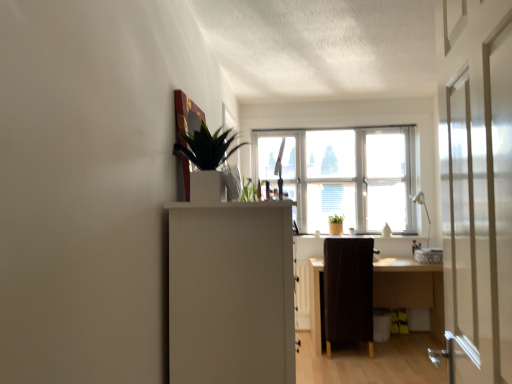
Question: From the image's perspective, is white glossy screen door at right above transparent glass window at center?

Choices:
 (A) yes
 (B) no

Answer: (B)

Question: Is white glossy screen door at right closer to camera compared to transparent glass window at center?

Choices:
 (A) yes
 (B) no

Answer: (A)

Question: Is white glossy screen door at right wider than transparent glass window at center?

Choices:
 (A) yes
 (B) no

Answer: (A)

Question: Is white glossy screen door at right completely or partially outside of transparent glass window at center?

Choices:
 (A) yes
 (B) no

Answer: (A)

Question: Are white glossy screen door at right and transparent glass window at center far apart?

Choices:
 (A) no
 (B) yes

Answer: (B)

Question: From a real-world perspective, is white glossy screen door at right under transparent glass window at center?

Choices:
 (A) no
 (B) yes

Answer: (B)

Question: Can you confirm if white matte cabinet at center is positioned to the right of green glossy plant at upper center?

Choices:
 (A) no
 (B) yes

Answer: (B)

Question: Is white matte cabinet at center far away from green glossy plant at upper center?

Choices:
 (A) yes
 (B) no

Answer: (B)

Question: Does white matte cabinet at center have a larger size compared to green glossy plant at upper center?

Choices:
 (A) no
 (B) yes

Answer: (B)

Question: From a real-world perspective, does white matte cabinet at center stand above green glossy plant at upper center?

Choices:
 (A) yes
 (B) no

Answer: (B)

Question: Does white matte cabinet at center have a greater width compared to green glossy plant at upper center?

Choices:
 (A) yes
 (B) no

Answer: (A)

Question: Is the position of white matte cabinet at center more distant than that of green glossy plant at upper center?

Choices:
 (A) no
 (B) yes

Answer: (A)

Question: Is wooden desk at center bigger than white glossy window sill at center?

Choices:
 (A) yes
 (B) no

Answer: (A)